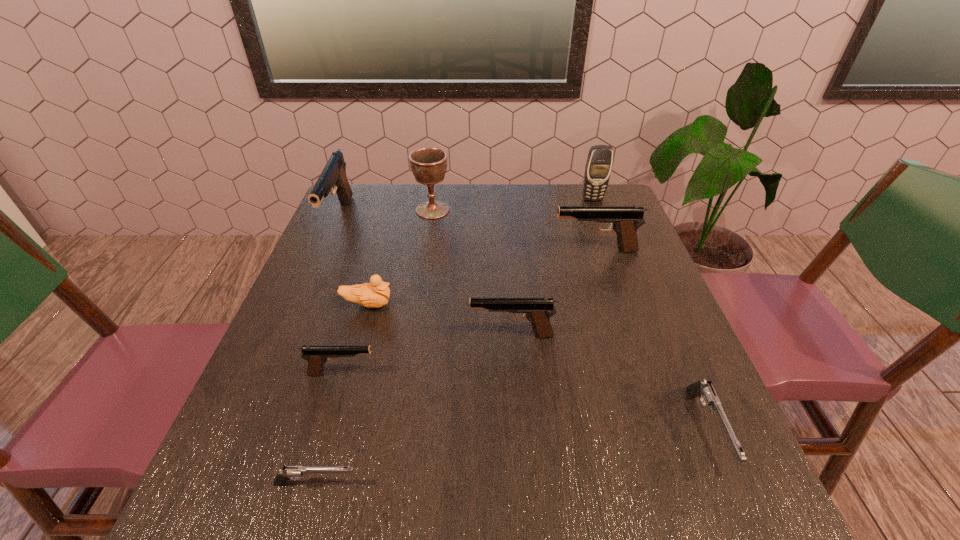
You are a GUI agent. You are given a task and a screenshot of the screen. Output one action in this format:
    pyautogui.click(x=<x>, y=<y>)
    Task: Click on the third black pistol from right to left
    
    Given the screenshot: What is the action you would take?
    pyautogui.click(x=316, y=355)

Where is `the right silver pistol`? This screenshot has width=960, height=540. the right silver pistol is located at coordinates (706, 392).

I want to click on the smaller silver pistol, so click(289, 472).

Where is `the shortest object`? This screenshot has height=540, width=960. the shortest object is located at coordinates (289, 472).

Where is `blank space located 0.230m on the front of the chalice`? This screenshot has height=540, width=960. blank space located 0.230m on the front of the chalice is located at coordinates (423, 271).

Where is `free space located on the front face of the cellular telephone`? free space located on the front face of the cellular telephone is located at coordinates (600, 220).

Find the location of a particular element. This screenshot has width=960, height=540. free location located at the muzzle of the leftmost black pistol is located at coordinates (305, 299).

You are a GUI agent. You are given a task and a screenshot of the screen. Output one action in this format:
    pyautogui.click(x=<x>, y=<y>)
    Task: Click on the free space located at the muzzle of the second tallest pistol
    
    Given the screenshot: What is the action you would take?
    pyautogui.click(x=418, y=251)

You are a GUI agent. You are given a task and a screenshot of the screen. Output one action in this format:
    pyautogui.click(x=<x>, y=<y>)
    Task: Click on the vacant region located at the muzzle of the second tallest pistol
    
    Given the screenshot: What is the action you would take?
    pyautogui.click(x=421, y=251)

Where is `vacant region located at the muzzle of the second tallest pistol`? Image resolution: width=960 pixels, height=540 pixels. vacant region located at the muzzle of the second tallest pistol is located at coordinates (406, 251).